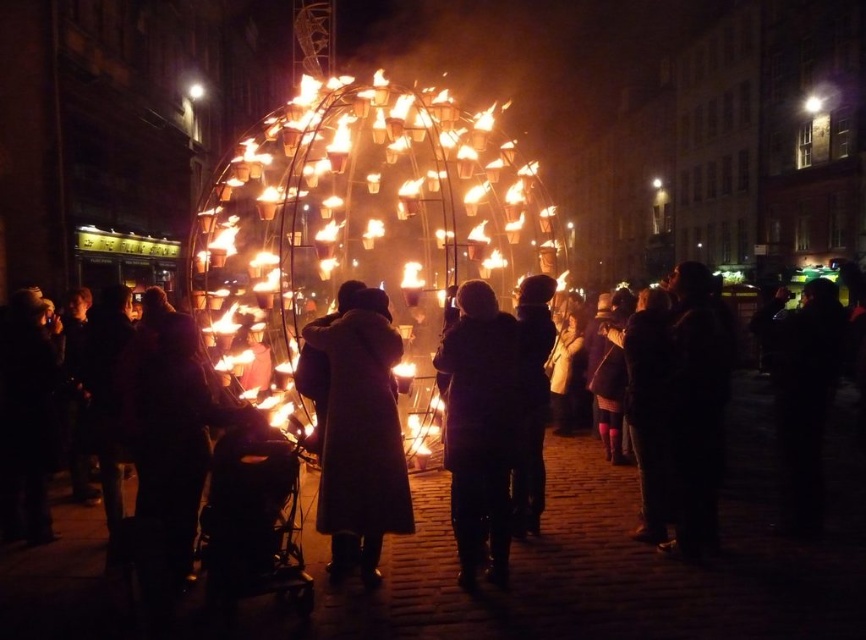
From the picture: Who is taller, dark wool coat at center or dark gray coat at center?

dark gray coat at center is taller.

Which is in front, point (343, 522) or point (459, 360)?

Point (343, 522) is more forward.

This screenshot has height=640, width=866. Find the location of `dark wool coat at center`. dark wool coat at center is located at coordinates (360, 432).

Is point (412, 492) behind point (346, 492)?

Yes, point (412, 492) is farther from viewer.

At what (x,y) coordinates should I click in order to perform the action: click on matte black coat at center. Please return your answer as a coordinate pair (x, y). The image size is (866, 640). Looking at the image, I should click on (621, 554).

What are the coordinates of `matte black coat at center` in the screenshot? It's located at (621, 554).

The height and width of the screenshot is (640, 866). I want to click on matte black coat at center, so click(621, 554).

Between point (433, 525) and point (457, 342), which one is positioned in front?

Point (457, 342)

Find the location of a particular element. Image resolution: width=866 pixels, height=640 pixels. matte black coat at center is located at coordinates (621, 554).